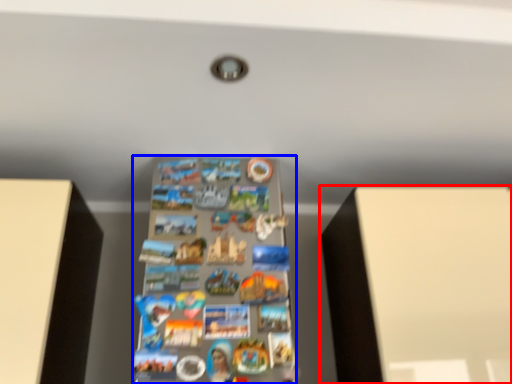
Question: Which point is closer to the camera, furniture (highlighted by a red box) or shelf (highlighted by a blue box)?

Choices:
 (A) furniture
 (B) shelf

Answer: (B)